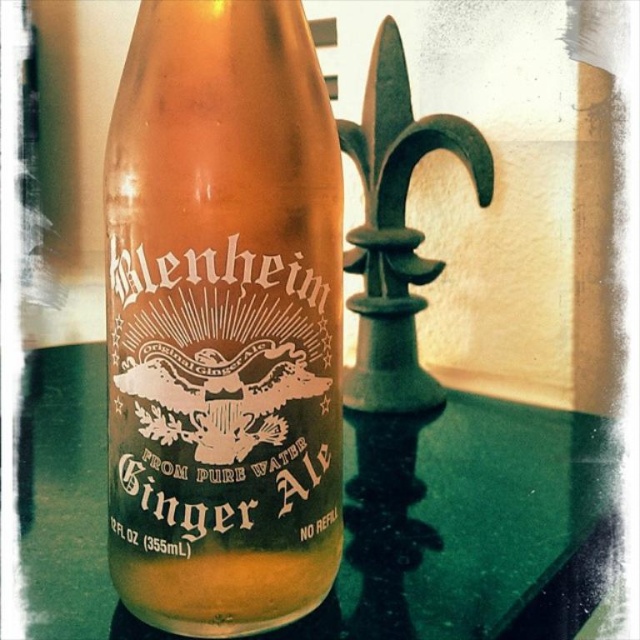
Question: Which point is farther from the camera taking this photo?

Choices:
 (A) (154, 193)
 (B) (374, 625)

Answer: (B)

Question: Can you confirm if translucent amber glass ginger ale at center is positioned to the right of green glass bottle at center?

Choices:
 (A) yes
 (B) no

Answer: (A)

Question: Is translucent amber glass ginger ale at center thinner than green glass bottle at center?

Choices:
 (A) yes
 (B) no

Answer: (A)

Question: Is translucent amber glass ginger ale at center to the right of green glass bottle at center from the viewer's perspective?

Choices:
 (A) yes
 (B) no

Answer: (A)